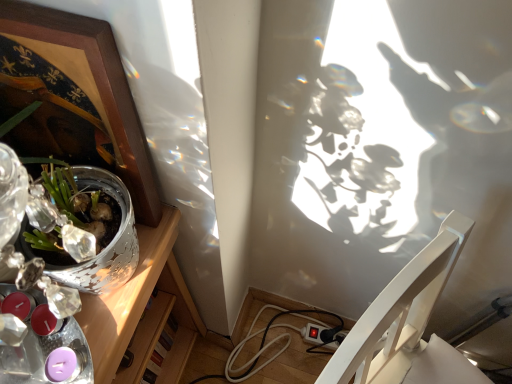
Question: Is wooden picture frame at upper left smaller than silver metallic pot at left?

Choices:
 (A) yes
 (B) no

Answer: (A)

Question: Is wooden picture frame at upper left facing away from silver metallic pot at left?

Choices:
 (A) no
 (B) yes

Answer: (A)

Question: Can you confirm if wooden picture frame at upper left is positioned to the right of silver metallic pot at left?

Choices:
 (A) no
 (B) yes

Answer: (B)

Question: Does wooden picture frame at upper left have a lesser height compared to silver metallic pot at left?

Choices:
 (A) yes
 (B) no

Answer: (A)

Question: From a real-world perspective, is wooden picture frame at upper left located higher than silver metallic pot at left?

Choices:
 (A) yes
 (B) no

Answer: (A)

Question: Is the depth of wooden picture frame at upper left greater than that of silver metallic pot at left?

Choices:
 (A) yes
 (B) no

Answer: (B)

Question: From the image's perspective, would you say white glossy chair at lower right is positioned over silver metallic pot at left?

Choices:
 (A) yes
 (B) no

Answer: (B)

Question: Does white glossy chair at lower right lie in front of silver metallic pot at left?

Choices:
 (A) no
 (B) yes

Answer: (B)

Question: Is white glossy chair at lower right positioned with its back to silver metallic pot at left?

Choices:
 (A) no
 (B) yes

Answer: (A)

Question: Is white glossy chair at lower right in contact with silver metallic pot at left?

Choices:
 (A) yes
 (B) no

Answer: (B)

Question: Does white glossy chair at lower right turn towards silver metallic pot at left?

Choices:
 (A) yes
 (B) no

Answer: (B)

Question: Can you confirm if white glossy chair at lower right is smaller than silver metallic pot at left?

Choices:
 (A) no
 (B) yes

Answer: (B)

Question: Does silver metallic pot at left have a smaller size compared to white glossy chair at lower right?

Choices:
 (A) no
 (B) yes

Answer: (A)